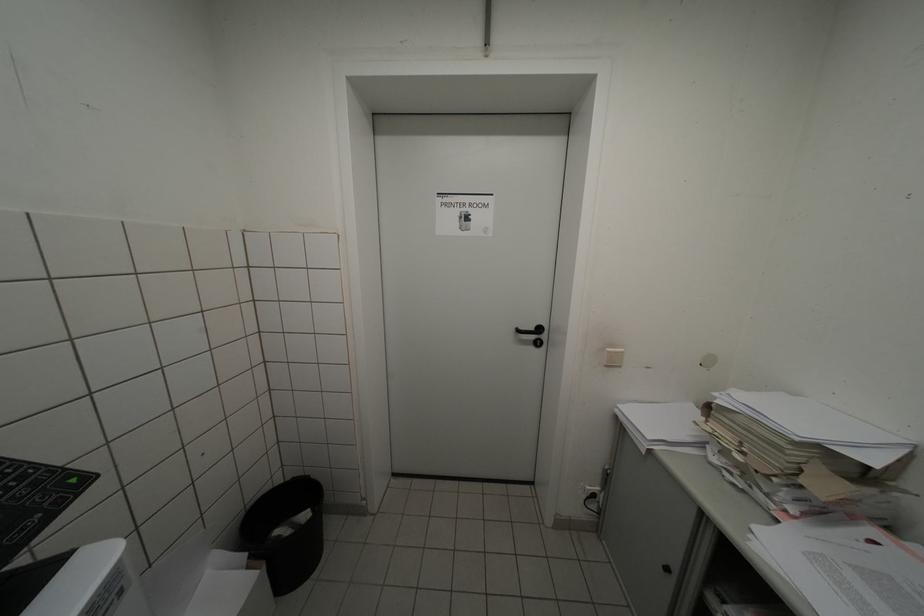
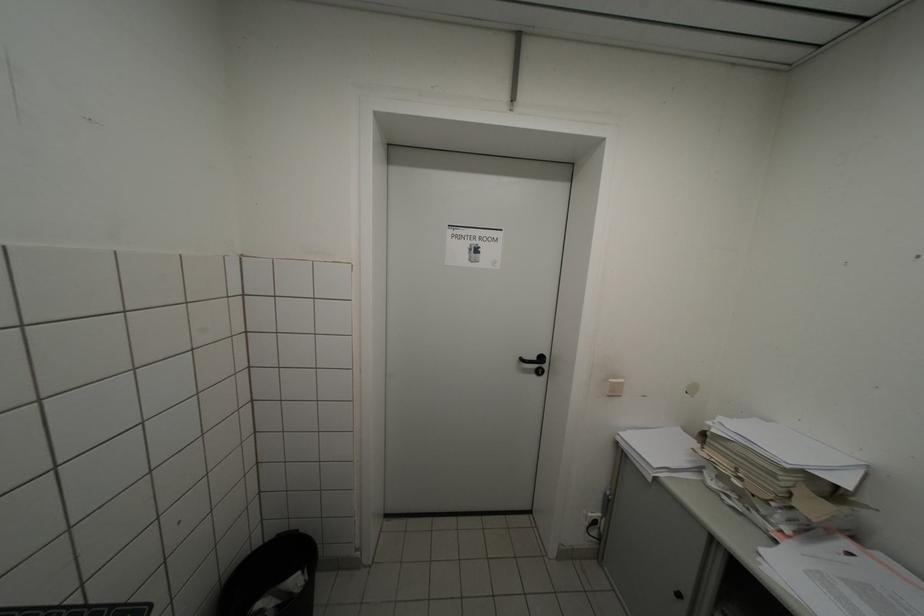
Find the pixel in the second image that matches (529,331) in the first image.

(532, 361)